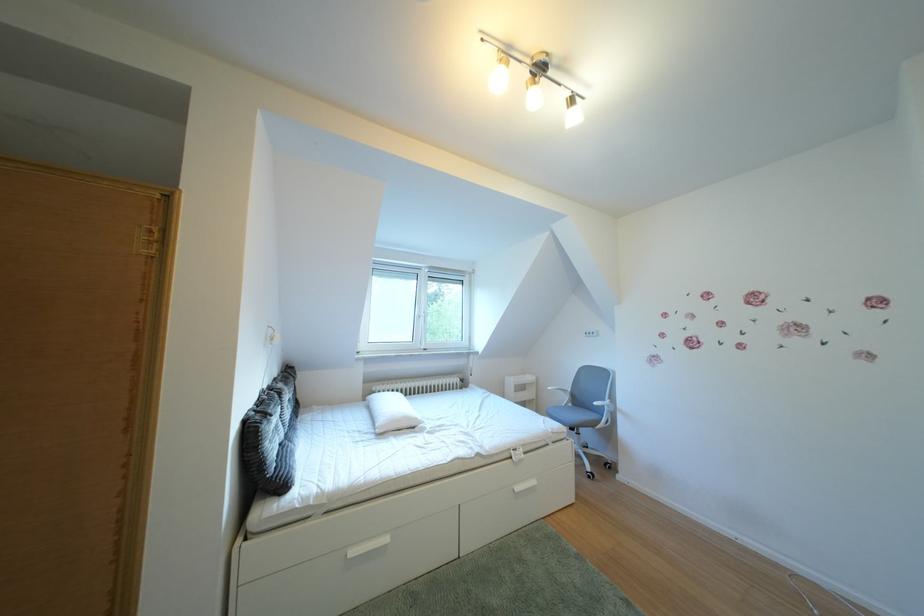
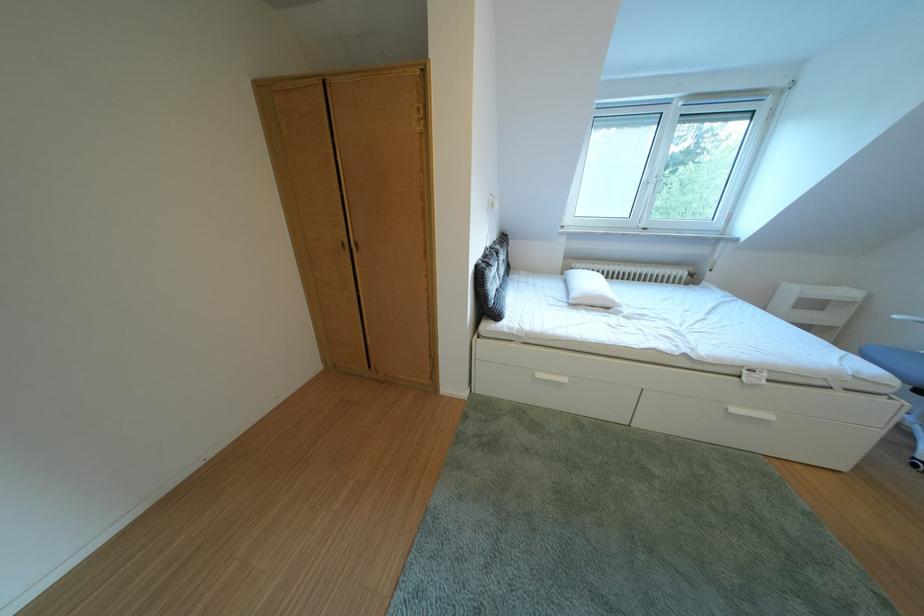
Find the pixel in the second image that matches point 387,394 in the first image.

(588, 270)